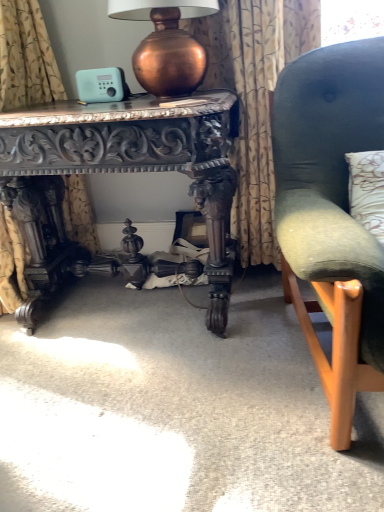
What is the approximate width of copper metallic table lamp at upper center?

The width of copper metallic table lamp at upper center is 34.67 centimeters.

In order to face copper metallic table lamp at upper center, should I rotate leftwards or rightwards?

Rotate your view left by about 3.105°.

What is the approximate height of gold floral fabric at left, which is the 1th curtain in left-to-right order?

The height of gold floral fabric at left, which is the 1th curtain in left-to-right order, is 1.09 meters.

Measure the distance between point (302,6) and camera.

Point (302,6) and camera are 1.38 meters apart.

Image resolution: width=384 pixels, height=512 pixels. What do you see at coordinates (120, 172) in the screenshot?
I see `dark wood carved table at center` at bounding box center [120, 172].

At what (x,y) coordinates should I click in order to perform the action: click on dark wood carved table at center. Please return your answer as a coordinate pair (x, y). Image resolution: width=384 pixels, height=512 pixels. Looking at the image, I should click on (120, 172).

The image size is (384, 512). I want to click on copper metallic table lamp at upper center, so [x=166, y=44].

Measure the distance between gold floral fabric at left, which is the 1th curtain in left-to-right order, and copper metallic table lamp at upper center.

gold floral fabric at left, which is the 1th curtain in left-to-right order, and copper metallic table lamp at upper center are 19.69 inches apart.

Considering the sizes of gold floral fabric at left, the second curtain when ordered from right to left, and copper metallic table lamp at upper center in the image, is gold floral fabric at left, the second curtain when ordered from right to left, wider or thinner than copper metallic table lamp at upper center?

gold floral fabric at left, the second curtain when ordered from right to left, is thinner than copper metallic table lamp at upper center.

From a real-world perspective, is gold floral fabric at left, which is the 1th curtain in left-to-right order, physically below copper metallic table lamp at upper center?

Yes, from a real-world perspective, gold floral fabric at left, which is the 1th curtain in left-to-right order, is beneath copper metallic table lamp at upper center.

Can you confirm if gold floral fabric at left, the second curtain when ordered from right to left, is smaller than copper metallic table lamp at upper center?

No.

Considering the positions of objects velvet green chair at right and gold floral fabric at left, the second curtain when ordered from right to left, in the image provided, who is more to the left, velvet green chair at right or gold floral fabric at left, the second curtain when ordered from right to left,?

Positioned to the left is gold floral fabric at left, the second curtain when ordered from right to left.

From a real-world perspective, is velvet green chair at right above or below gold floral fabric at left, which is the 1th curtain in left-to-right order?

From a real-world perspective, velvet green chair at right is physically below gold floral fabric at left, which is the 1th curtain in left-to-right order.

Is velvet green chair at right touching gold floral fabric at left, which is the 1th curtain in left-to-right order?

No, velvet green chair at right is not beside gold floral fabric at left, which is the 1th curtain in left-to-right order.

At what (x,y) coordinates should I click in order to perform the action: click on curtain that is the 1st one when counting upward from the velvet green chair at right (from the image's perspective). Please return your answer as a coordinate pair (x, y). This screenshot has width=384, height=512. Looking at the image, I should click on (26, 57).

Is gold floral fabric at left, which is the 1th curtain in left-to-right order, closer to the viewer compared to velvet green chair at right?

No, it is behind velvet green chair at right.

From a real-world perspective, relative to velvet green chair at right, is gold floral fabric at left, the second curtain when ordered from right to left, vertically above or below?

In terms of real-world spatial position, gold floral fabric at left, the second curtain when ordered from right to left, is above velvet green chair at right.

Between gold floral fabric at left, the second curtain when ordered from right to left, and velvet green chair at right, which one has larger width?

With larger width is velvet green chair at right.

How distant is floral-patterned fabric at center, positioned as the 1th curtain in right-to-left order, from velvet green chair at right?

A distance of 14.87 inches exists between floral-patterned fabric at center, positioned as the 1th curtain in right-to-left order, and velvet green chair at right.

Between floral-patterned fabric at center, positioned as the 1th curtain in right-to-left order, and velvet green chair at right, which one has more height?

floral-patterned fabric at center, positioned as the 1th curtain in right-to-left order, is taller.

Is floral-patterned fabric at center, positioned as the 1th curtain in right-to-left order, wider than velvet green chair at right?

Incorrect, the width of floral-patterned fabric at center, positioned as the 1th curtain in right-to-left order, does not surpass that of velvet green chair at right.

How different are the orientations of floral-patterned fabric at center, positioned as the 1th curtain in right-to-left order, and velvet green chair at right in degrees?

The facing directions of floral-patterned fabric at center, positioned as the 1th curtain in right-to-left order, and velvet green chair at right are 4.79 degrees apart.

From the picture: Which of these two, copper metallic table lamp at upper center or gold floral fabric at left, which is the 1th curtain in left-to-right order, stands shorter?

Standing shorter between the two is copper metallic table lamp at upper center.

From the image's perspective, which one is positioned lower, copper metallic table lamp at upper center or gold floral fabric at left, the second curtain when ordered from right to left?

gold floral fabric at left, the second curtain when ordered from right to left.

From a real-world perspective, is copper metallic table lamp at upper center physically located above or below gold floral fabric at left, which is the 1th curtain in left-to-right order?

copper metallic table lamp at upper center is situated higher than gold floral fabric at left, which is the 1th curtain in left-to-right order, in the real world.

Is velvet green chair at right to the left of dark wood carved table at center from the viewer's perspective?

No.

Who is bigger, velvet green chair at right or dark wood carved table at center?

velvet green chair at right is bigger.

Considering the relative sizes of velvet green chair at right and dark wood carved table at center in the image provided, is velvet green chair at right shorter than dark wood carved table at center?

Incorrect, the height of velvet green chair at right does not fall short of that of dark wood carved table at center.

I want to click on table that appears behind the velvet green chair at right, so click(120, 172).

Considering the relative positions of copper metallic table lamp at upper center and dark wood carved table at center in the image provided, is copper metallic table lamp at upper center behind dark wood carved table at center?

Yes, the depth of copper metallic table lamp at upper center is greater than that of dark wood carved table at center.

How many degrees apart are the facing directions of copper metallic table lamp at upper center and dark wood carved table at center?

0.718 degrees.

Is dark wood carved table at center at the back of copper metallic table lamp at upper center?

No, dark wood carved table at center is not at the back of copper metallic table lamp at upper center.

You are a GUI agent. You are given a task and a screenshot of the screen. Output one action in this format:
    pyautogui.click(x=<x>, y=<y>)
    Task: Click on the table lamp above the dark wood carved table at center (from a real-world perspective)
    This screenshot has height=512, width=384.
    Given the screenshot: What is the action you would take?
    pyautogui.click(x=166, y=44)

There is a copper metallic table lamp at upper center. Identify the location of the 2nd curtain below it (from the image's perspective). This screenshot has height=512, width=384. (26, 57).

At what (x,y) coordinates should I click in order to perform the action: click on the 1st curtain above the velvet green chair at right (from the image's perspective). Please return your answer as a coordinate pair (x, y). The width and height of the screenshot is (384, 512). Looking at the image, I should click on (26, 57).

When comparing their distances from copper metallic table lamp at upper center, does velvet green chair at right or floral-patterned fabric at center, the 2th curtain positioned from the left, seem closer?

floral-patterned fabric at center, the 2th curtain positioned from the left, is closer to copper metallic table lamp at upper center.

When comparing their distances from copper metallic table lamp at upper center, does velvet green chair at right or gold floral fabric at left, which is the 1th curtain in left-to-right order, seem further?

The object further to copper metallic table lamp at upper center is velvet green chair at right.

Considering their positions, is gold floral fabric at left, the second curtain when ordered from right to left, positioned closer to floral-patterned fabric at center, positioned as the 1th curtain in right-to-left order, than dark wood carved table at center?

Among the two, dark wood carved table at center is located nearer to floral-patterned fabric at center, positioned as the 1th curtain in right-to-left order.

Looking at the image, which one is located further to gold floral fabric at left, which is the 1th curtain in left-to-right order, copper metallic table lamp at upper center or velvet green chair at right?

velvet green chair at right is positioned further to the anchor gold floral fabric at left, which is the 1th curtain in left-to-right order.

Based on their spatial positions, is velvet green chair at right or dark wood carved table at center further from floral-patterned fabric at center, the 2th curtain positioned from the left?

Based on the image, dark wood carved table at center appears to be further to floral-patterned fabric at center, the 2th curtain positioned from the left.

Considering their positions, is velvet green chair at right positioned further to gold floral fabric at left, the second curtain when ordered from right to left, than floral-patterned fabric at center, the 2th curtain positioned from the left?

velvet green chair at right.

Looking at the image, which one is located further to velvet green chair at right, dark wood carved table at center or gold floral fabric at left, which is the 1th curtain in left-to-right order?

Based on the image, gold floral fabric at left, which is the 1th curtain in left-to-right order, appears to be further to velvet green chair at right.

Looking at the image, which one is located further to copper metallic table lamp at upper center, floral-patterned fabric at center, the 2th curtain positioned from the left, or dark wood carved table at center?

dark wood carved table at center lies further to copper metallic table lamp at upper center than the other object.

Locate an element on the screen. The width and height of the screenshot is (384, 512). table lamp between velvet green chair at right and floral-patterned fabric at center, the 2th curtain positioned from the left, along the z-axis is located at coordinates (166, 44).

Image resolution: width=384 pixels, height=512 pixels. What are the coordinates of `table lamp located between dark wood carved table at center and velvet green chair at right in the left-right direction` in the screenshot? It's located at (166, 44).

Image resolution: width=384 pixels, height=512 pixels. In order to click on table between velvet green chair at right and floral-patterned fabric at center, positioned as the 1th curtain in right-to-left order, along the z-axis in this screenshot , I will do `click(120, 172)`.

Image resolution: width=384 pixels, height=512 pixels. What are the coordinates of `table lamp between gold floral fabric at left, the second curtain when ordered from right to left, and velvet green chair at right, in the horizontal direction` in the screenshot? It's located at (166, 44).